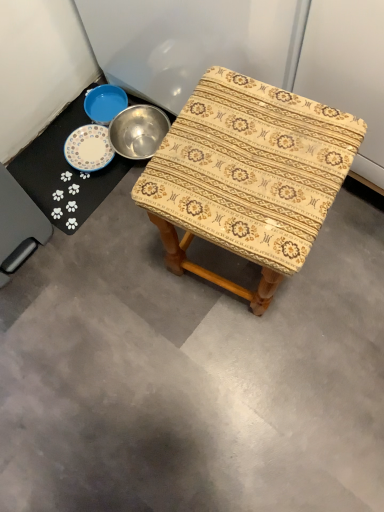
At what (x,y) coordinates should I click in order to perform the action: click on free spot to the right of patterned fabric stool at center. Please return your answer as a coordinate pair (x, y). This screenshot has height=512, width=384. Looking at the image, I should click on (341, 265).